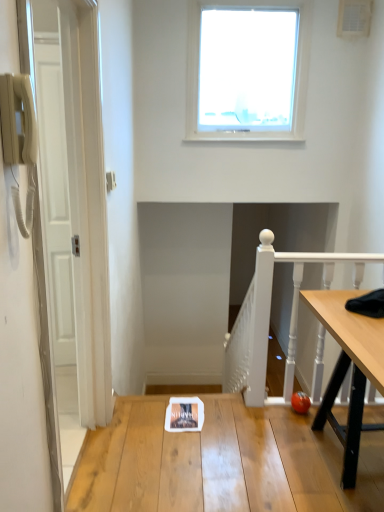
Question: Does wooden table at center have a lesser height compared to white painted wood at right?

Choices:
 (A) yes
 (B) no

Answer: (A)

Question: Considering the relative sizes of wooden table at center and white painted wood at right in the image provided, is wooden table at center bigger than white painted wood at right?

Choices:
 (A) no
 (B) yes

Answer: (B)

Question: Is wooden table at center facing towards white painted wood at right?

Choices:
 (A) no
 (B) yes

Answer: (A)

Question: From the image's perspective, is wooden table at center below white painted wood at right?

Choices:
 (A) no
 (B) yes

Answer: (B)

Question: Is wooden table at center not near white painted wood at right?

Choices:
 (A) no
 (B) yes

Answer: (A)

Question: Is the position of wooden table at center more distant than that of white painted wood at right?

Choices:
 (A) no
 (B) yes

Answer: (A)

Question: From a real-world perspective, is transparent glass window at upper center positioned under wooden table at center based on gravity?

Choices:
 (A) yes
 (B) no

Answer: (B)

Question: Considering the relative sizes of transparent glass window at upper center and wooden table at center in the image provided, is transparent glass window at upper center thinner than wooden table at center?

Choices:
 (A) no
 (B) yes

Answer: (B)

Question: Is transparent glass window at upper center further to the viewer compared to wooden table at center?

Choices:
 (A) yes
 (B) no

Answer: (A)

Question: Is transparent glass window at upper center not within wooden table at center?

Choices:
 (A) no
 (B) yes

Answer: (B)

Question: From the image's perspective, would you say transparent glass window at upper center is shown under wooden table at center?

Choices:
 (A) no
 (B) yes

Answer: (A)

Question: Is transparent glass window at upper center aimed at wooden table at center?

Choices:
 (A) yes
 (B) no

Answer: (B)

Question: Is transparent glass window at upper center facing away from white painted wood at right?

Choices:
 (A) no
 (B) yes

Answer: (A)